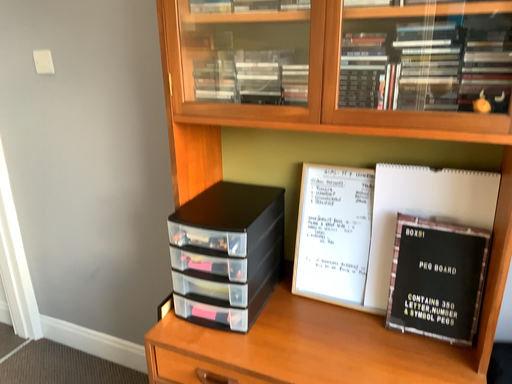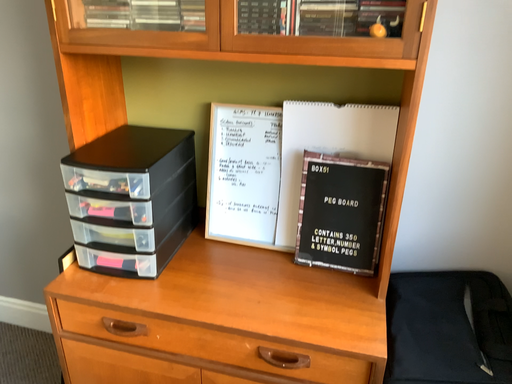
Question: How did the camera likely rotate when shooting the video?

Choices:
 (A) rotated right
 (B) rotated left

Answer: (A)